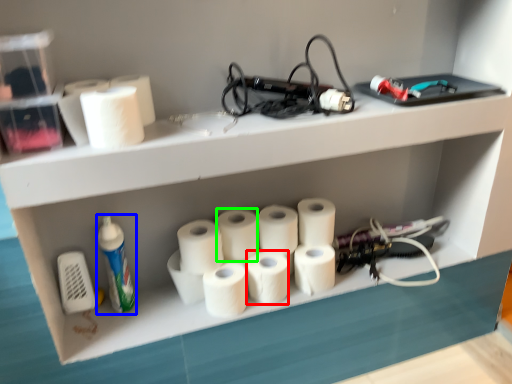
Question: Estimate the real-world distances between objects in this image. Which object is farther from paper towel (highlighted by a red box), cleaning product (highlighted by a blue box) or paper towel (highlighted by a green box)?

Choices:
 (A) cleaning product
 (B) paper towel

Answer: (A)